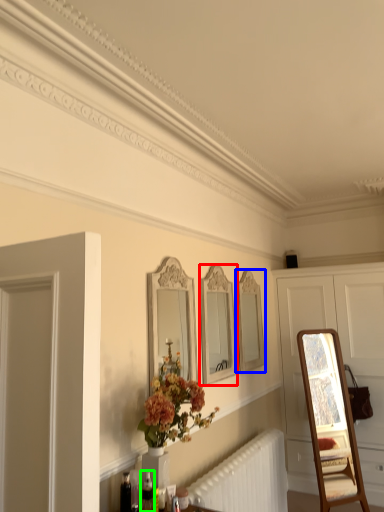
Question: Which object is positioned closest to mirror (highlighted by a red box)? Select from mirror (highlighted by a blue box) and toiletry (highlighted by a green box).

Choices:
 (A) mirror
 (B) toiletry

Answer: (A)